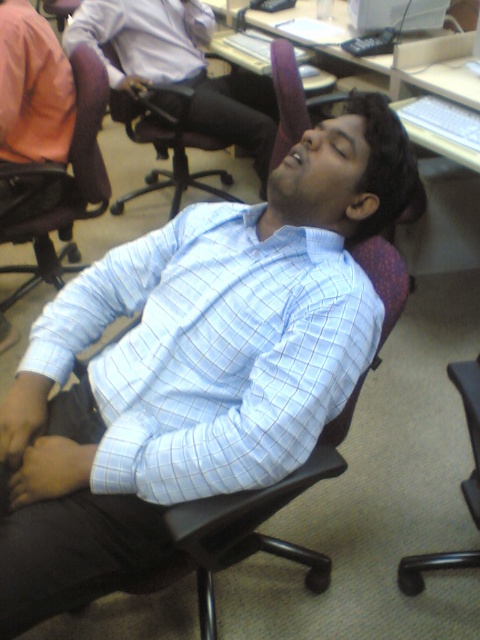
Question: Does light blue checkered shirt at center have a larger size compared to matte white shirt at upper center?

Choices:
 (A) yes
 (B) no

Answer: (B)

Question: Which object is positioned closest to the brown leather chair at left?

Choices:
 (A) matte white shirt at upper center
 (B) matte black laptop at upper center

Answer: (A)

Question: Does matte black laptop at upper center appear under white glossy computer desk at upper center?

Choices:
 (A) no
 (B) yes

Answer: (B)

Question: Estimate the real-world distances between objects in this image. Which object is farther from the brown leather chair at left?

Choices:
 (A) light blue checkered shirt at center
 (B) matte black laptop at upper center
 (C) matte white shirt at upper center

Answer: (A)

Question: Does light blue checkered shirt at center come behind matte black laptop at upper center?

Choices:
 (A) yes
 (B) no

Answer: (B)

Question: Which point is closer to the camera?

Choices:
 (A) (257, 440)
 (B) (264, 129)
 (C) (419, 88)
 (D) (58, 266)

Answer: (A)